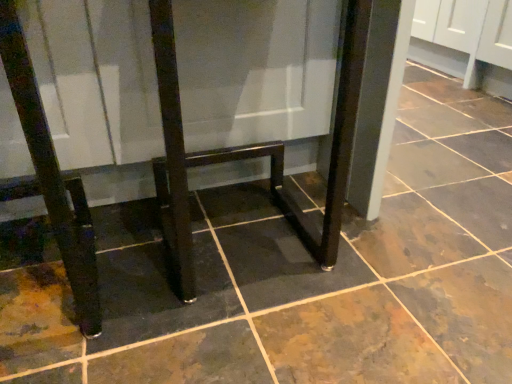
Question: Should I look upward or downward to see glossy dark wood table at center, which is counted as the 1th furniture, starting from the left?

Choices:
 (A) down
 (B) up

Answer: (B)

Question: Is glossy dark wood table at center, the 2th furniture when ordered from right to left, oriented towards glossy dark wood table at center, which appears as the first furniture when viewed from the right?

Choices:
 (A) yes
 (B) no

Answer: (B)

Question: From the image's perspective, does glossy dark wood table at center, which is counted as the 1th furniture, starting from the left, appear lower than glossy dark wood table at center, which appears as the first furniture when viewed from the right?

Choices:
 (A) no
 (B) yes

Answer: (A)

Question: Is glossy dark wood table at center, which is counted as the 1th furniture, starting from the left, shorter than glossy dark wood table at center, the 2th furniture from the left?

Choices:
 (A) yes
 (B) no

Answer: (B)

Question: From a real-world perspective, is glossy dark wood table at center, the 2th furniture when ordered from right to left, positioned over glossy dark wood table at center, the 2th furniture from the left, based on gravity?

Choices:
 (A) yes
 (B) no

Answer: (B)

Question: Does glossy dark wood table at center, which is counted as the 1th furniture, starting from the left, appear on the left side of glossy dark wood table at center, the 2th furniture from the left?

Choices:
 (A) no
 (B) yes

Answer: (B)

Question: Does glossy dark wood table at center, the 2th furniture when ordered from right to left, have a larger size compared to glossy dark wood table at center, the 2th furniture from the left?

Choices:
 (A) yes
 (B) no

Answer: (A)

Question: Can you confirm if glossy dark wood table at center, which appears as the first furniture when viewed from the right, is positioned to the left of glossy dark wood table at center, the 2th furniture when ordered from right to left?

Choices:
 (A) yes
 (B) no

Answer: (B)

Question: Are glossy dark wood table at center, which appears as the first furniture when viewed from the right, and glossy dark wood table at center, the 2th furniture when ordered from right to left, beside each other?

Choices:
 (A) no
 (B) yes

Answer: (B)

Question: From a real-world perspective, is glossy dark wood table at center, which appears as the first furniture when viewed from the right, physically above glossy dark wood table at center, the 2th furniture when ordered from right to left?

Choices:
 (A) yes
 (B) no

Answer: (A)

Question: Does glossy dark wood table at center, the 2th furniture from the left, have a lesser width compared to glossy dark wood table at center, the 2th furniture when ordered from right to left?

Choices:
 (A) yes
 (B) no

Answer: (A)

Question: Is glossy dark wood table at center, the 2th furniture when ordered from right to left, completely or partially inside glossy dark wood table at center, which appears as the first furniture when viewed from the right?

Choices:
 (A) no
 (B) yes

Answer: (A)

Question: Is the depth of glossy dark wood table at center, which appears as the first furniture when viewed from the right, greater than that of glossy dark wood table at center, the 2th furniture when ordered from right to left?

Choices:
 (A) no
 (B) yes

Answer: (B)

Question: Considering the positions of glossy dark wood table at center, the 2th furniture from the left, and glossy dark wood table at center, which is counted as the 1th furniture, starting from the left, in the image, is glossy dark wood table at center, the 2th furniture from the left, bigger or smaller than glossy dark wood table at center, which is counted as the 1th furniture, starting from the left,?

Choices:
 (A) big
 (B) small

Answer: (B)